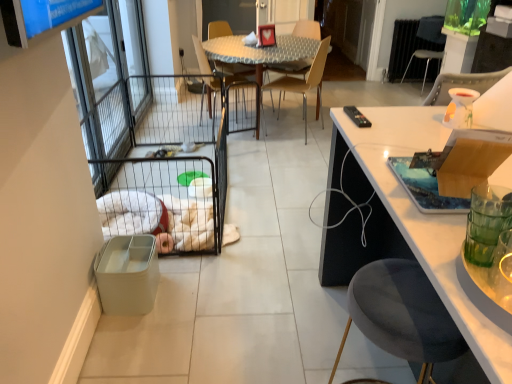
Find the location of a particular element. The width and height of the screenshot is (512, 384). free spot to the right of matte plastic trash bin at lower left is located at coordinates (182, 292).